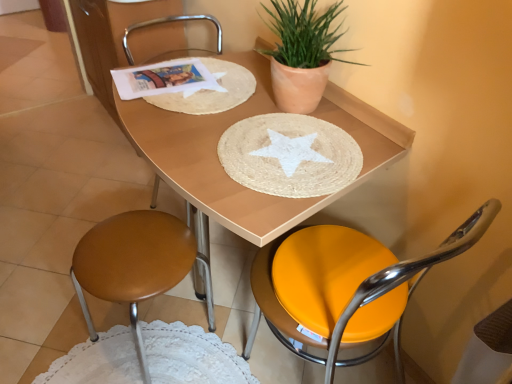
This screenshot has height=384, width=512. I want to click on blank space to the left of wooden seat at lower left, the first chair positioned from the left, so click(x=56, y=332).